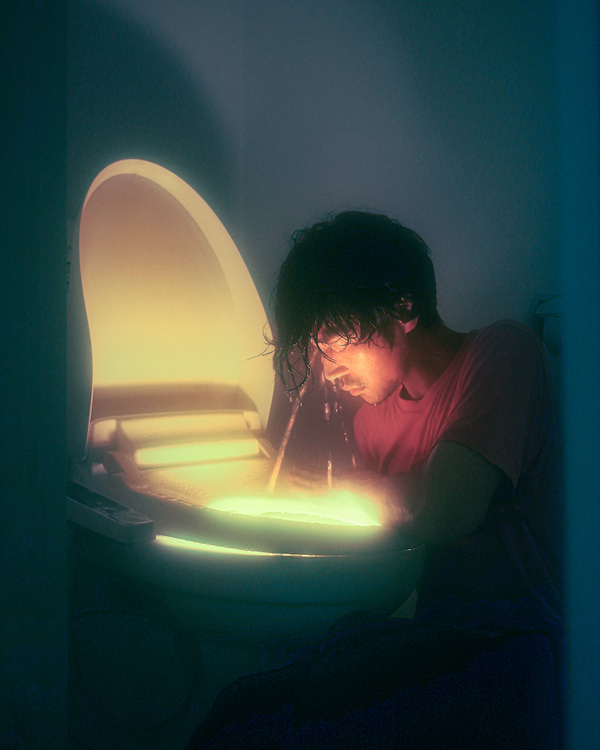
Locate an element on the screen. toilet stand is located at coordinates (210, 697).